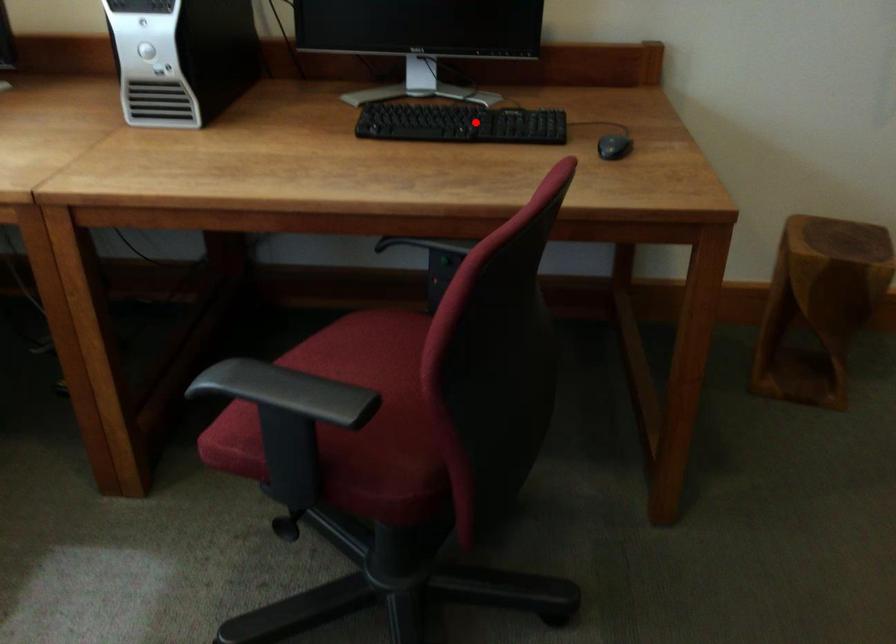
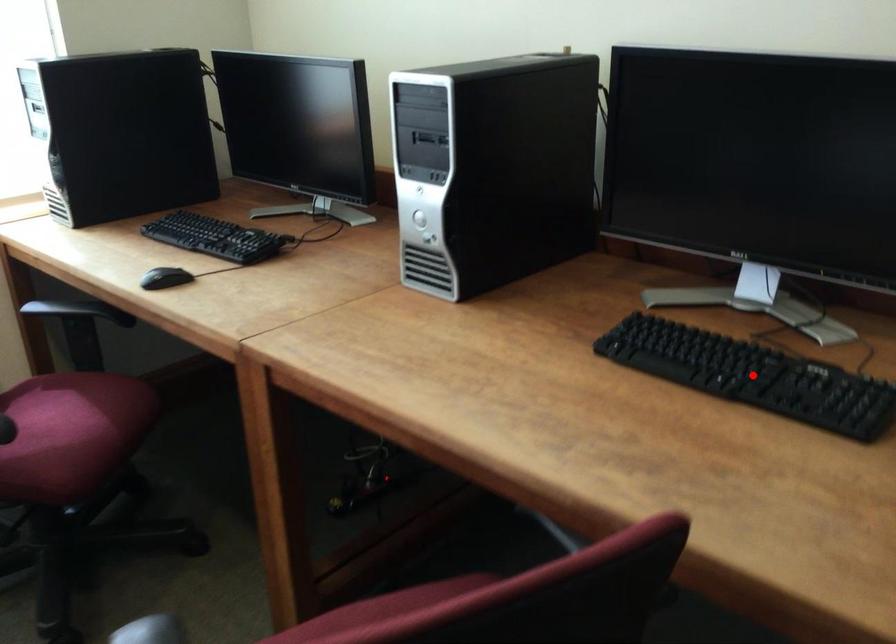
I am providing you with two images of the same scene from different viewpoints. A red point is marked on the first image and another point is marked on the second image. Is the red point in image1 aligned with the point shown in image2?

Yes